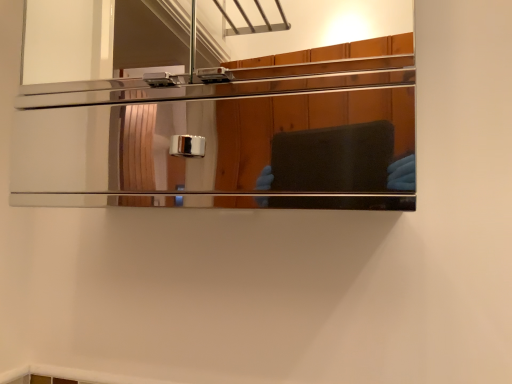
This screenshot has height=384, width=512. In order to click on polished chrome mirror at upper center in this screenshot , I will do `click(226, 134)`.

Looking at this image, in order to face polished chrome mirror at upper center, should I rotate leftwards or rightwards?

To face it directly, rotate left by 10.136 degrees.

This screenshot has width=512, height=384. What do you see at coordinates (226, 134) in the screenshot?
I see `polished chrome mirror at upper center` at bounding box center [226, 134].

Where is `polished chrome mirror at upper center`? polished chrome mirror at upper center is located at coordinates (226, 134).